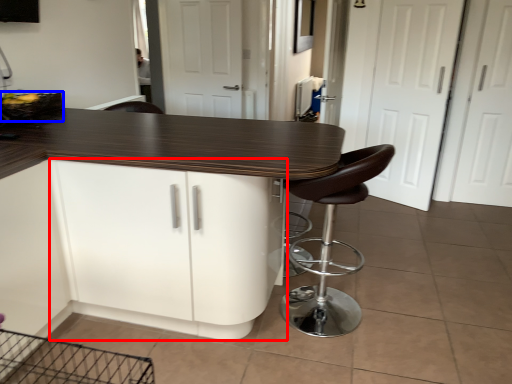
Question: Which object appears farthest to the camera in this image, cabinetry (highlighted by a red box) or basket (highlighted by a blue box)?

Choices:
 (A) cabinetry
 (B) basket

Answer: (B)